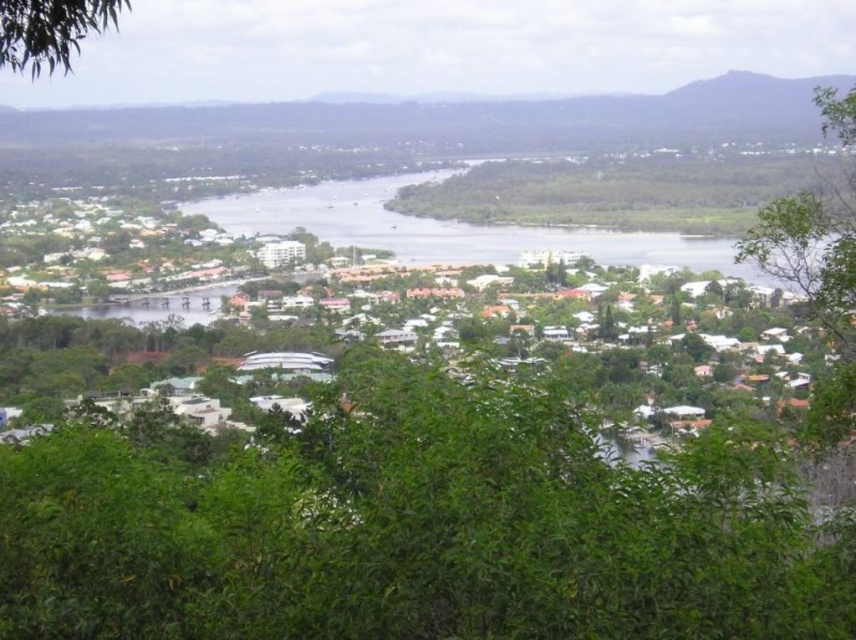
You are standing at the viewpoint overlooking the coastal town. You notice two green leafy trees in the scene. Which tree, the green leafy tree at center or the green leafy tree at upper left, is closer to you?

The green leafy tree at center is closer to you because it is in front of the green leafy tree at upper left, which means it is positioned nearer to your viewpoint.

You are standing at the top of the hill and looking down at the coastal town. You see two green leafy trees in the scene. Which tree is positioned to the right when comparing the green leafy tree at center and the green leafy tree at upper left?

The green leafy tree at center is positioned to the right of the green leafy tree at upper left.

You are a landscape architect planning to plant new trees in the coastal town. You have two green leafy trees available. The first is the green leafy tree at center and the second is the green leafy tree at right. Which tree has a wider canopy to provide more shade?

The green leafy tree at center has a wider width than the green leafy tree at right, so it provides more shade.